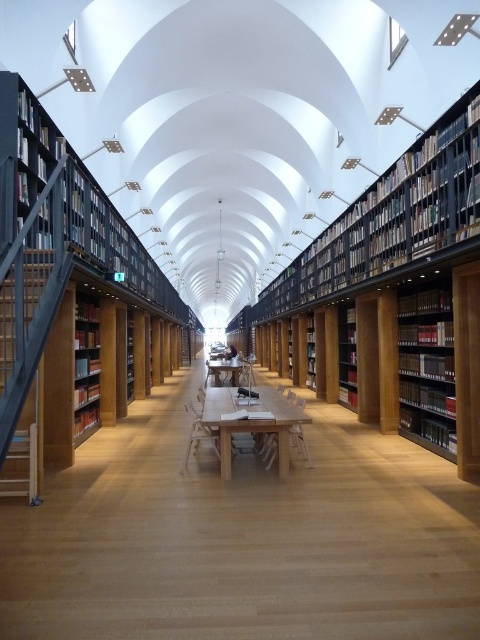
Is dark gray wood bookshelf at left positioned in front of wooden bookshelf at left?

Yes, it is.

Is dark gray wood bookshelf at left to the right of wooden bookshelf at left from the viewer's perspective?

Incorrect, dark gray wood bookshelf at left is not on the right side of wooden bookshelf at left.

The height and width of the screenshot is (640, 480). I want to click on dark gray wood bookshelf at left, so pyautogui.click(x=71, y=298).

Find the location of a particular element. dark gray wood bookshelf at left is located at coordinates (71, 298).

Consider the image. Does dark gray wood bookshelf at left appear under matte black bookshelf at right?

No.

Is point (76, 182) in front of point (419, 422)?

Yes, it is in front of point (419, 422).

What are the coordinates of `dark gray wood bookshelf at left` in the screenshot? It's located at (71, 298).

In order to click on dark gray wood bookshelf at left in this screenshot , I will do `click(71, 298)`.

Who is more forward, (32, 346) or (305, 422)?

Point (32, 346) is in front.

What are the coordinates of `dark gray wooden stairs at left` in the screenshot? It's located at (24, 330).